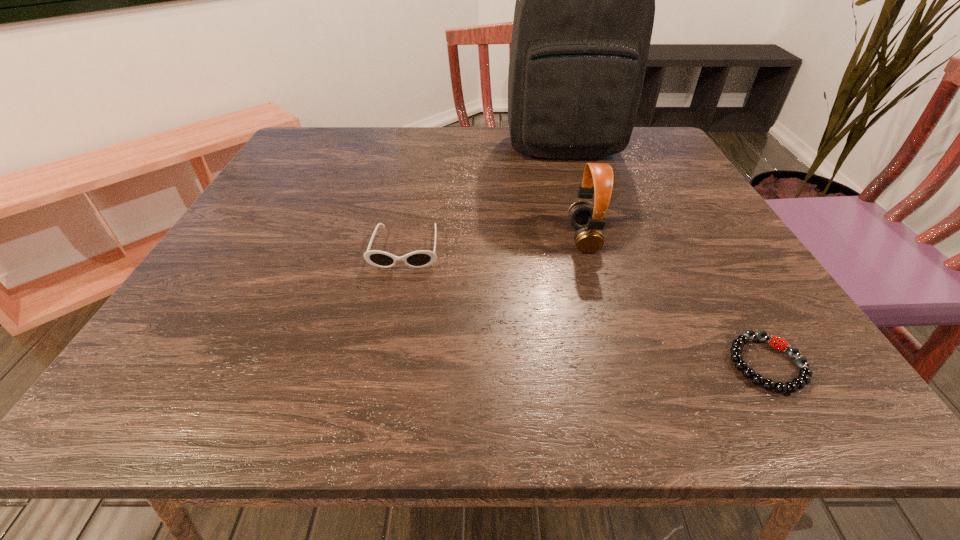
Where is `vacant space that satisfies the following two spatial constraints: 1. on the ear cups of the nearest object; 2. on the right side of the headset`? This screenshot has width=960, height=540. vacant space that satisfies the following two spatial constraints: 1. on the ear cups of the nearest object; 2. on the right side of the headset is located at coordinates (620, 364).